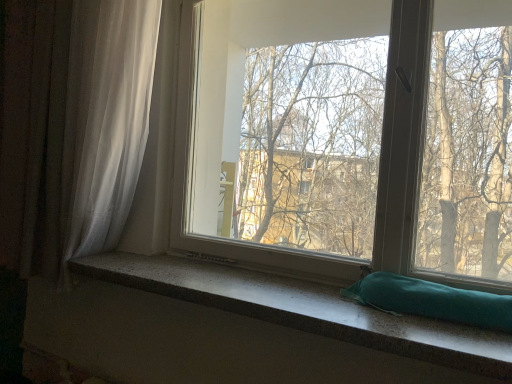
Describe the element at coordinates (348, 137) in the screenshot. I see `transparent glass window at center` at that location.

Locate an element on the screen. teal fabric pillow at lower right is located at coordinates (432, 301).

You are a GUI agent. You are given a task and a screenshot of the screen. Output one action in this format:
    pyautogui.click(x=<x>, y=<y>)
    Task: Click on the white sheer curtain at left
    
    Given the screenshot: What is the action you would take?
    pyautogui.click(x=78, y=131)

Locate an element on the screen. transparent glass window at center is located at coordinates (348, 137).

From the image's perspective, which is below, teal fabric pillow at lower right or transparent glass window at center?

teal fabric pillow at lower right is shown below in the image.

How different are the orientations of teal fabric pillow at lower right and transparent glass window at center in degrees?

2.35 degrees.

Is teal fabric pillow at lower right completely or partially outside of transparent glass window at center?

teal fabric pillow at lower right is positioned outside transparent glass window at center.

Does point (421, 315) come in front of point (218, 116)?

Yes, point (421, 315) is closer to viewer.

Does white sheer curtain at left appear on the left side of granite-like teal pillow at lower center?

Yes.

In the image, is white sheer curtain at left positioned in front of or behind granite-like teal pillow at lower center?

white sheer curtain at left is positioned farther from the viewer than granite-like teal pillow at lower center.

What are the coordinates of `window sill below the white sheer curtain at left (from a real-world perspective)` in the screenshot? It's located at (305, 309).

Is there a large distance between white sheer curtain at left and granite-like teal pillow at lower center?

No.

Can you confirm if granite-like teal pillow at lower center is smaller than transparent glass window at center?

Yes.

Is the surface of granite-like teal pillow at lower center in direct contact with transparent glass window at center?

granite-like teal pillow at lower center is not next to transparent glass window at center, and they're not touching.

Does point (231, 268) appear closer or farther from the camera than point (314, 3)?

Point (231, 268) is positioned closer to the camera compared to point (314, 3).

Considering the relative sizes of granite-like teal pillow at lower center and transparent glass window at center in the image provided, is granite-like teal pillow at lower center shorter than transparent glass window at center?

Yes.

Considering the sizes of objects teal fabric pillow at lower right and white sheer curtain at left in the image provided, who is thinner, teal fabric pillow at lower right or white sheer curtain at left?

Thinner between the two is teal fabric pillow at lower right.

Is teal fabric pillow at lower right smaller than white sheer curtain at left?

Yes.

The width and height of the screenshot is (512, 384). Identify the location of curtain behind the teal fabric pillow at lower right. (78, 131).

Does white sheer curtain at left touch transparent glass window at center?

No, white sheer curtain at left is not touching transparent glass window at center.

Consider the image. Is white sheer curtain at left located outside transparent glass window at center?

Yes.

From their relative heights in the image, would you say white sheer curtain at left is taller or shorter than transparent glass window at center?

In the image, white sheer curtain at left appears to be taller than transparent glass window at center.

Which is in front, point (67, 216) or point (241, 151)?

The point (67, 216) is closer to the camera.

Is transparent glass window at center in contact with white sheer curtain at left?

transparent glass window at center and white sheer curtain at left are not in contact.

Which is more to the left, transparent glass window at center or white sheer curtain at left?

Positioned to the left is white sheer curtain at left.

Which is behind, transparent glass window at center or white sheer curtain at left?

white sheer curtain at left.

Is granite-like teal pillow at lower center wider than teal fabric pillow at lower right?

Yes.

What are the coordinates of `pillow above the granite-like teal pillow at lower center (from a real-world perspective)` in the screenshot? It's located at (432, 301).

Which is more to the right, granite-like teal pillow at lower center or teal fabric pillow at lower right?

teal fabric pillow at lower right is more to the right.

From the image's perspective, which is below, granite-like teal pillow at lower center or teal fabric pillow at lower right?

From the image's view, granite-like teal pillow at lower center is below.

Where is `window located on the left of teal fabric pillow at lower right`? Image resolution: width=512 pixels, height=384 pixels. window located on the left of teal fabric pillow at lower right is located at coordinates (348, 137).

The height and width of the screenshot is (384, 512). Identify the location of window sill below the white sheer curtain at left (from the image's perspective). (305, 309).

From the picture: From the image, which object appears to be farther from transparent glass window at center, teal fabric pillow at lower right or white sheer curtain at left?

teal fabric pillow at lower right is positioned further to the anchor transparent glass window at center.

Considering their positions, is white sheer curtain at left positioned closer to granite-like teal pillow at lower center than transparent glass window at center?

white sheer curtain at left is closer to granite-like teal pillow at lower center.

Based on the photo, considering their positions, is transparent glass window at center positioned closer to white sheer curtain at left than granite-like teal pillow at lower center?

granite-like teal pillow at lower center is closer to white sheer curtain at left.

From the image, which object appears to be nearer to teal fabric pillow at lower right, granite-like teal pillow at lower center or white sheer curtain at left?

The object closer to teal fabric pillow at lower right is granite-like teal pillow at lower center.

From the image, which object appears to be nearer to granite-like teal pillow at lower center, teal fabric pillow at lower right or white sheer curtain at left?

teal fabric pillow at lower right lies closer to granite-like teal pillow at lower center than the other object.

Which object lies further to the anchor point white sheer curtain at left, granite-like teal pillow at lower center or teal fabric pillow at lower right?

teal fabric pillow at lower right is positioned further to the anchor white sheer curtain at left.

Based on their spatial positions, is white sheer curtain at left or transparent glass window at center further from teal fabric pillow at lower right?

white sheer curtain at left is further to teal fabric pillow at lower right.

When comparing their distances from granite-like teal pillow at lower center, does white sheer curtain at left or teal fabric pillow at lower right seem closer?

teal fabric pillow at lower right is closer to granite-like teal pillow at lower center.

I want to click on pillow between transparent glass window at center and granite-like teal pillow at lower center vertically, so click(432, 301).

In order to click on window between white sheer curtain at left and teal fabric pillow at lower right in the horizontal direction in this screenshot , I will do `click(348, 137)`.

Image resolution: width=512 pixels, height=384 pixels. Find the location of `window sill between white sheer curtain at left and teal fabric pillow at lower right in the horizontal direction`. window sill between white sheer curtain at left and teal fabric pillow at lower right in the horizontal direction is located at coordinates (305, 309).

At what (x,y) coordinates should I click in order to perform the action: click on window sill situated between white sheer curtain at left and transparent glass window at center from left to right. Please return your answer as a coordinate pair (x, y). Looking at the image, I should click on (305, 309).